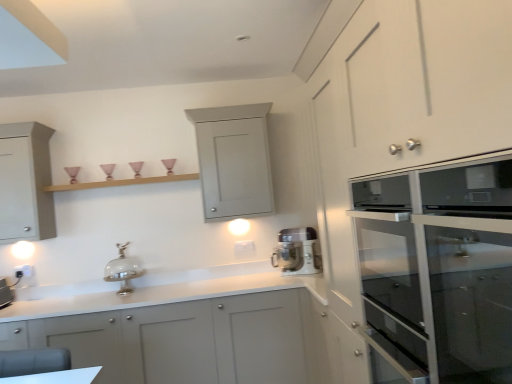
This screenshot has height=384, width=512. What do you see at coordinates (123, 270) in the screenshot?
I see `shiny silver cake stand at center` at bounding box center [123, 270].

Consider the image. In order to face wooden shelf at upper center, should I rotate leftwards or rightwards?

Rotate your view left by about 17.154°.

Based on the photo, measure the distance between point [207,110] and camera.

Point [207,110] is 3.12 meters away from camera.

Locate an element on the screen. matte gray cabinet at lower left, the third cabinetry when ordered from back to front is located at coordinates (181, 340).

From the image's perspective, between white plastic electric outlet at lower left and white glossy stand mixer at center, which one is located above?

From the image's view, white glossy stand mixer at center is above.

Does white plastic electric outlet at lower left turn towards white glossy stand mixer at center?

No, white plastic electric outlet at lower left is not aimed at white glossy stand mixer at center.

Between white plastic electric outlet at lower left and white glossy stand mixer at center, which one has more height?

Standing taller between the two is white glossy stand mixer at center.

Identify the location of shelf above the matte glass oven at right, the first cabinetry from the front (from a real-world perspective). Image resolution: width=512 pixels, height=384 pixels. (122, 182).

Does wooden shelf at upper center turn towards matte glass oven at right, positioned as the fourth cabinetry in back-to-front order?

No, wooden shelf at upper center does not turn towards matte glass oven at right, positioned as the fourth cabinetry in back-to-front order.

Which of these two, wooden shelf at upper center or matte glass oven at right, positioned as the fourth cabinetry in back-to-front order, stands shorter?

wooden shelf at upper center.

Looking at the image, does wooden shelf at upper center seem bigger or smaller compared to matte glass oven at right, positioned as the fourth cabinetry in back-to-front order?

In the image, wooden shelf at upper center appears to be smaller than matte glass oven at right, positioned as the fourth cabinetry in back-to-front order.

Is wooden shelf at upper center at the back of matte gray cabinet at lower left, the third cabinetry when ordered from back to front?

No, matte gray cabinet at lower left, the third cabinetry when ordered from back to front, is not facing the opposite direction of wooden shelf at upper center.

Does matte gray cabinet at lower left, the third cabinetry when ordered from back to front, have a greater height compared to wooden shelf at upper center?

Correct, matte gray cabinet at lower left, the third cabinetry when ordered from back to front, is much taller as wooden shelf at upper center.

Is point (26, 268) positioned after point (415, 339)?

Yes.

Between white plastic electric outlet at lower left and matte glass oven at right, positioned as the fourth cabinetry in back-to-front order, which one has larger size?

Bigger between the two is matte glass oven at right, positioned as the fourth cabinetry in back-to-front order.

From the image's perspective, is white plastic electric outlet at lower left over matte glass oven at right, positioned as the fourth cabinetry in back-to-front order?

No, from the image's perspective, white plastic electric outlet at lower left is not above matte glass oven at right, positioned as the fourth cabinetry in back-to-front order.

How distant is white plastic electric outlet at lower left from matte glass oven at right, positioned as the fourth cabinetry in back-to-front order?

white plastic electric outlet at lower left and matte glass oven at right, positioned as the fourth cabinetry in back-to-front order, are 9.57 feet apart from each other.

Considering the relative sizes of white glossy stand mixer at center and matte glass oven at right, positioned as the fourth cabinetry in back-to-front order, in the image provided, is white glossy stand mixer at center smaller than matte glass oven at right, positioned as the fourth cabinetry in back-to-front order,?

Indeed, white glossy stand mixer at center has a smaller size compared to matte glass oven at right, positioned as the fourth cabinetry in back-to-front order.

Which point is more distant from viewer, [300,258] or [419,350]?

Positioned behind is point [300,258].

From the image's perspective, which is above, white glossy stand mixer at center or matte glass oven at right, positioned as the fourth cabinetry in back-to-front order?

matte glass oven at right, positioned as the fourth cabinetry in back-to-front order.

Is white glossy stand mixer at center positioned far away from matte glass oven at right, the first cabinetry from the front?

Yes, white glossy stand mixer at center is far from matte glass oven at right, the first cabinetry from the front.

Is the position of white plastic electric outlet at lower left less distant than that of matte gray cabinet at lower left, which is counted as the 2th cabinetry, starting from the front?

No, white plastic electric outlet at lower left is further to the viewer.

In terms of height, does white plastic electric outlet at lower left look taller or shorter compared to matte gray cabinet at lower left, the third cabinetry when ordered from back to front?

Clearly, white plastic electric outlet at lower left is shorter compared to matte gray cabinet at lower left, the third cabinetry when ordered from back to front.

Between point (32, 274) and point (141, 368), which one is positioned behind?

The point (32, 274) is farther from the camera.

Considering the relative sizes of matte gray cabinet at upper center, the 1th cabinetry positioned from the back, and matte gray cabinet at lower left, the third cabinetry when ordered from back to front, in the image provided, is matte gray cabinet at upper center, the 1th cabinetry positioned from the back, bigger than matte gray cabinet at lower left, the third cabinetry when ordered from back to front,?

No.

Who is shorter, matte gray cabinet at upper center, the fourth cabinetry from the front, or matte gray cabinet at lower left, which is counted as the 2th cabinetry, starting from the front?

Standing shorter between the two is matte gray cabinet at upper center, the fourth cabinetry from the front.

In the scene shown: Is matte gray cabinet at upper center, the 1th cabinetry positioned from the back, positioned with its back to matte gray cabinet at lower left, which is counted as the 2th cabinetry, starting from the front?

No, matte gray cabinet at upper center, the 1th cabinetry positioned from the back, is not facing away from matte gray cabinet at lower left, which is counted as the 2th cabinetry, starting from the front.

Is matte gray cabinet at upper center, the fourth cabinetry from the front, in contact with matte gray cabinet at lower left, the third cabinetry when ordered from back to front?

There is a gap between matte gray cabinet at upper center, the fourth cabinetry from the front, and matte gray cabinet at lower left, the third cabinetry when ordered from back to front.

This screenshot has height=384, width=512. I want to click on electric outlet behind the white glossy stand mixer at center, so click(23, 271).

The image size is (512, 384). Find the location of `shelf that appears above the matte glass oven at right, positioned as the fourth cabinetry in back-to-front order (from a real-world perspective)`. shelf that appears above the matte glass oven at right, positioned as the fourth cabinetry in back-to-front order (from a real-world perspective) is located at coordinates (122, 182).

Considering their positions, is shiny silver cake stand at center positioned closer to white glossy stand mixer at center than matte gray cabinet at left, which ranks as the third cabinetry in front-to-back order?

shiny silver cake stand at center is closer to white glossy stand mixer at center.

Looking at the image, which one is located further to shiny silver cake stand at center, matte glass oven at right, the first cabinetry from the front, or white glossy stand mixer at center?

matte glass oven at right, the first cabinetry from the front, is further to shiny silver cake stand at center.

When comparing their distances from matte gray cabinet at lower left, which is counted as the 2th cabinetry, starting from the front, does wooden shelf at upper center or matte glass oven at right, the first cabinetry from the front, seem further?

matte glass oven at right, the first cabinetry from the front, lies further to matte gray cabinet at lower left, which is counted as the 2th cabinetry, starting from the front, than the other object.

When comparing their distances from matte glass oven at right, positioned as the fourth cabinetry in back-to-front order, does wooden shelf at upper center or white glossy stand mixer at center seem closer?

The object closer to matte glass oven at right, positioned as the fourth cabinetry in back-to-front order, is white glossy stand mixer at center.

When comparing their distances from wooden shelf at upper center, does matte gray cabinet at left, which ranks as the 2th cabinetry in back-to-front order, or matte gray cabinet at lower left, the third cabinetry when ordered from back to front, seem further?

matte gray cabinet at lower left, the third cabinetry when ordered from back to front.

Looking at the image, which one is located further to matte glass oven at right, the first cabinetry from the front, white glossy stand mixer at center or white plastic electric outlet at lower left?

The object further to matte glass oven at right, the first cabinetry from the front, is white plastic electric outlet at lower left.

Looking at the image, which one is located closer to matte gray cabinet at left, which ranks as the third cabinetry in front-to-back order, matte gray cabinet at lower left, the third cabinetry when ordered from back to front, or wooden shelf at upper center?

Based on the image, wooden shelf at upper center appears to be nearer to matte gray cabinet at left, which ranks as the third cabinetry in front-to-back order.

Looking at the image, which one is located further to white plastic electric outlet at lower left, matte gray cabinet at upper center, the 1th cabinetry positioned from the back, or matte glass oven at right, positioned as the fourth cabinetry in back-to-front order?

matte glass oven at right, positioned as the fourth cabinetry in back-to-front order, lies further to white plastic electric outlet at lower left than the other object.

This screenshot has height=384, width=512. I want to click on home appliance between matte gray cabinet at left, which ranks as the 2th cabinetry in back-to-front order, and matte glass oven at right, the first cabinetry from the front, from left to right, so click(297, 252).

At what (x,y) coordinates should I click in order to perform the action: click on kitchen appliance situated between white plastic electric outlet at lower left and white glossy stand mixer at center from left to right. Please return your answer as a coordinate pair (x, y). The width and height of the screenshot is (512, 384). Looking at the image, I should click on (123, 270).

I want to click on kitchen appliance between matte gray cabinet at upper center, the 1th cabinetry positioned from the back, and matte gray cabinet at lower left, which is counted as the 2th cabinetry, starting from the front, in the vertical direction, so click(x=123, y=270).

The image size is (512, 384). Find the location of `home appliance between white plastic electric outlet at lower left and matte glass oven at right, positioned as the fourth cabinetry in back-to-front order, in the horizontal direction`. home appliance between white plastic electric outlet at lower left and matte glass oven at right, positioned as the fourth cabinetry in back-to-front order, in the horizontal direction is located at coordinates (297, 252).